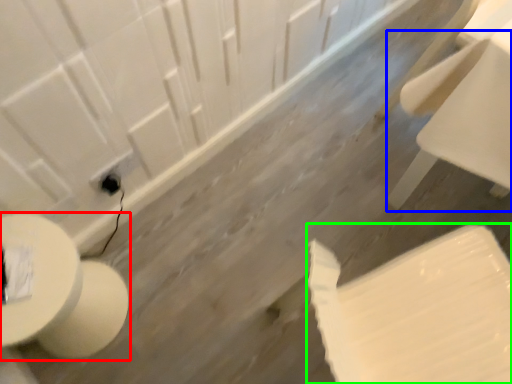
Question: Which object is positioned closest to toilet (highlighted by a red box)? Select from chair (highlighted by a blue box) and toilet paper (highlighted by a green box).

Choices:
 (A) chair
 (B) toilet paper

Answer: (B)